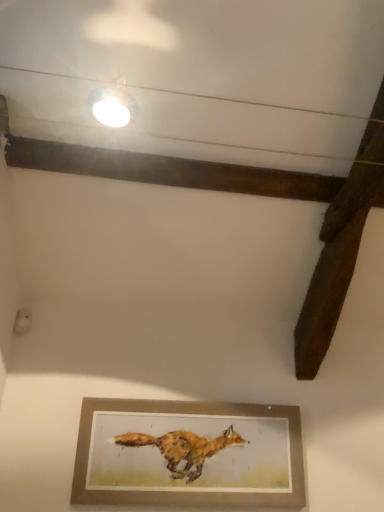
Question: Is wooden picture frame at lower center bigger or smaller than white glossy light fixture at upper center?

Choices:
 (A) small
 (B) big

Answer: (B)

Question: In terms of width, does wooden picture frame at lower center look wider or thinner when compared to white glossy light fixture at upper center?

Choices:
 (A) wide
 (B) thin

Answer: (B)

Question: In the image, is wooden picture frame at lower center positioned in front of or behind white glossy light fixture at upper center?

Choices:
 (A) behind
 (B) front

Answer: (A)

Question: Is white glossy light fixture at upper center situated inside wooden picture frame at lower center or outside?

Choices:
 (A) inside
 (B) outside

Answer: (B)

Question: In terms of size, does white glossy light fixture at upper center appear bigger or smaller than wooden picture frame at lower center?

Choices:
 (A) big
 (B) small

Answer: (B)

Question: From a real-world perspective, is white glossy light fixture at upper center above or below wooden picture frame at lower center?

Choices:
 (A) above
 (B) below

Answer: (A)

Question: Looking at their shapes, would you say white glossy light fixture at upper center is wider or thinner than wooden picture frame at lower center?

Choices:
 (A) thin
 (B) wide

Answer: (B)